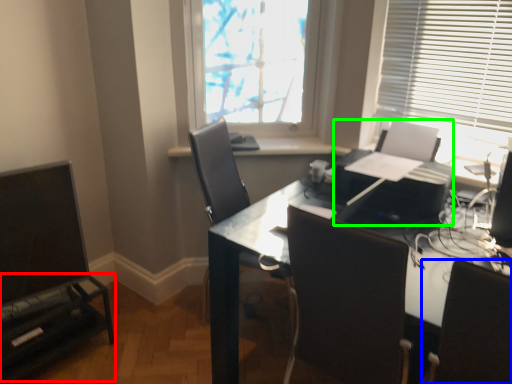
Question: Considering the real-world distances, which object is closest to entertainment center (highlighted by a red box)? chair (highlighted by a blue box) or printer (highlighted by a green box).

Choices:
 (A) chair
 (B) printer

Answer: (B)